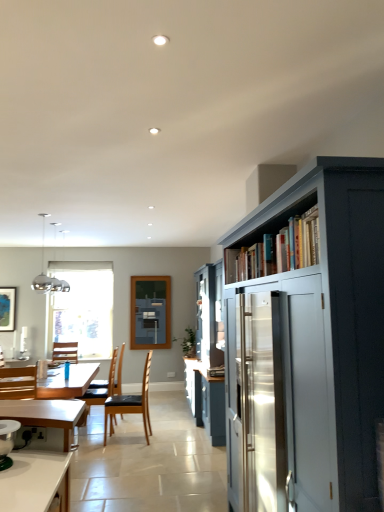
Find the location of a particular element. The width and height of the screenshot is (384, 512). free location in front of black leather chair at center, the 2th chair from the front is located at coordinates (116, 452).